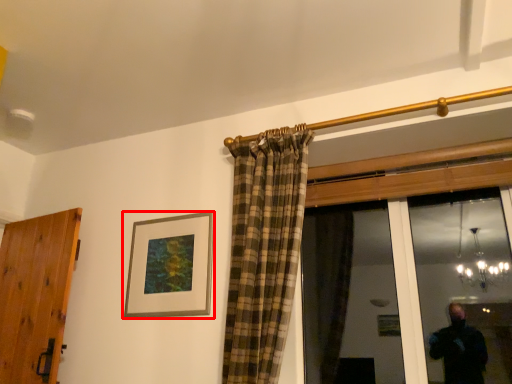
Question: Observing the image, what is the correct spatial positioning of picture frame (annotated by the red box) in reference to door?

Choices:
 (A) right
 (B) left

Answer: (A)